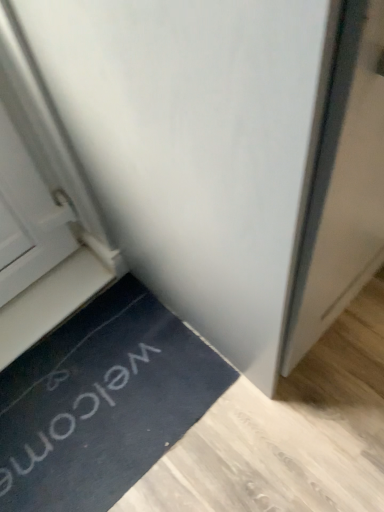
Question: Is white plastic stairwell at lower left far from black rubber doormat at lower left?

Choices:
 (A) yes
 (B) no

Answer: (B)

Question: Is white plastic stairwell at lower left to the left of black rubber doormat at lower left from the viewer's perspective?

Choices:
 (A) yes
 (B) no

Answer: (A)

Question: Does white plastic stairwell at lower left have a lesser width compared to black rubber doormat at lower left?

Choices:
 (A) no
 (B) yes

Answer: (B)

Question: Does white plastic stairwell at lower left have a greater width compared to black rubber doormat at lower left?

Choices:
 (A) no
 (B) yes

Answer: (A)

Question: Could black rubber doormat at lower left be considered to be inside white plastic stairwell at lower left?

Choices:
 (A) no
 (B) yes

Answer: (A)

Question: From the image's perspective, relative to black rubber doormat at lower left, is white matte door at center above or below?

Choices:
 (A) above
 (B) below

Answer: (A)

Question: Is white matte door at center situated inside black rubber doormat at lower left or outside?

Choices:
 (A) outside
 (B) inside

Answer: (A)

Question: Relative to black rubber doormat at lower left, is white matte door at center in front or behind?

Choices:
 (A) front
 (B) behind

Answer: (A)

Question: Is white matte door at center wider or thinner than black rubber doormat at lower left?

Choices:
 (A) wide
 (B) thin

Answer: (A)

Question: Considering the positions of point (294, 76) and point (59, 272), is point (294, 76) closer or farther from the camera than point (59, 272)?

Choices:
 (A) farther
 (B) closer

Answer: (B)

Question: Considering the relative positions of white matte door at center and white plastic stairwell at lower left in the image provided, is white matte door at center to the left or to the right of white plastic stairwell at lower left?

Choices:
 (A) right
 (B) left

Answer: (A)

Question: Is white matte door at center in front of or behind white plastic stairwell at lower left in the image?

Choices:
 (A) behind
 (B) front

Answer: (B)

Question: From a real-world perspective, is white matte door at center physically located above or below white plastic stairwell at lower left?

Choices:
 (A) above
 (B) below

Answer: (A)

Question: From a real-world perspective, is black rubber doormat at lower left above or below white matte door at center?

Choices:
 (A) above
 (B) below

Answer: (B)

Question: Is black rubber doormat at lower left inside the boundaries of white matte door at center, or outside?

Choices:
 (A) outside
 (B) inside

Answer: (A)